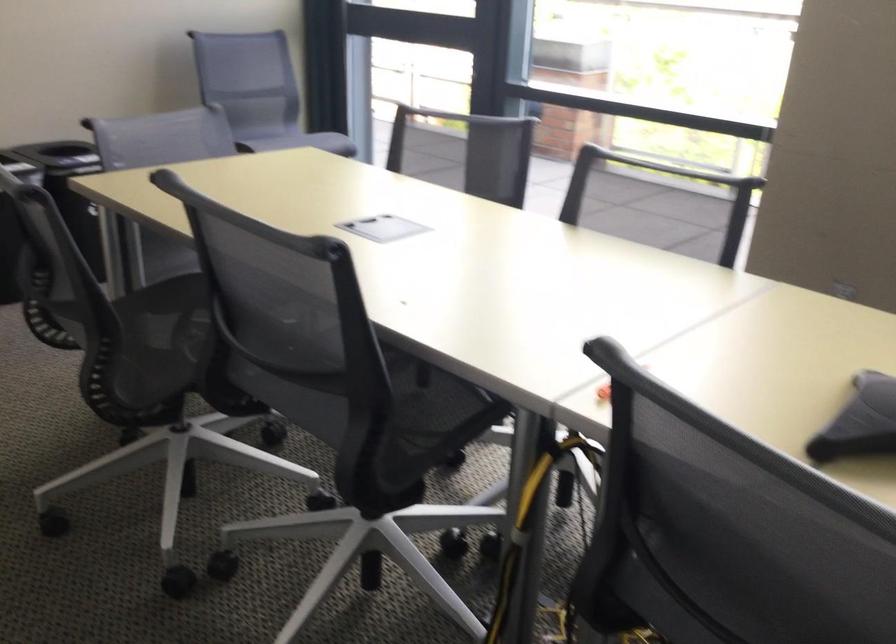
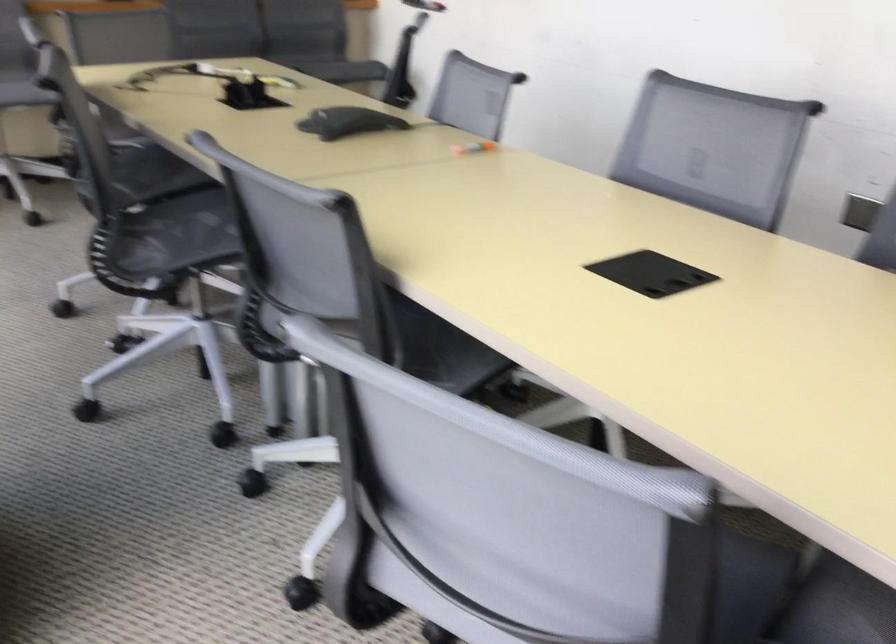
In the second image, find the point that corresponds to point 625,408 in the first image.

(474, 147)